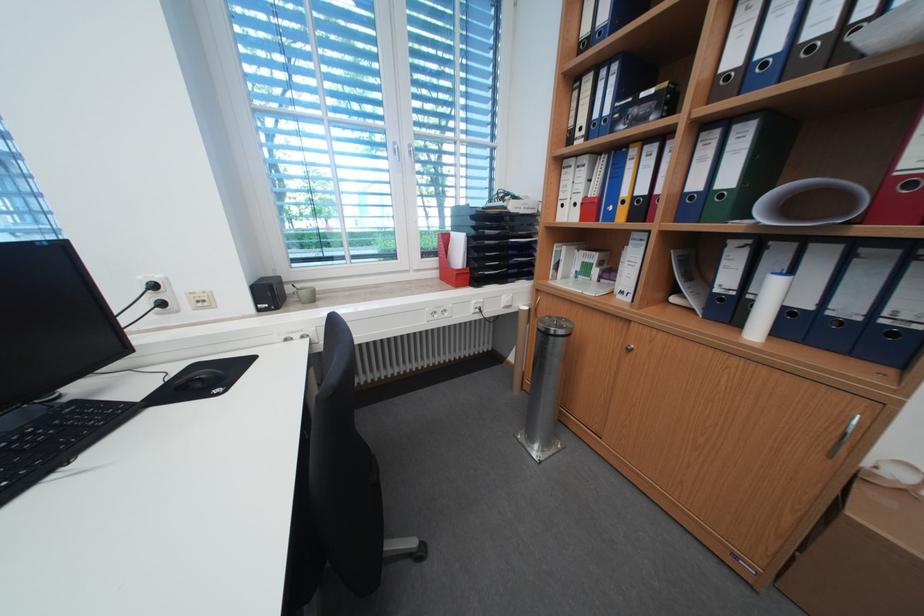
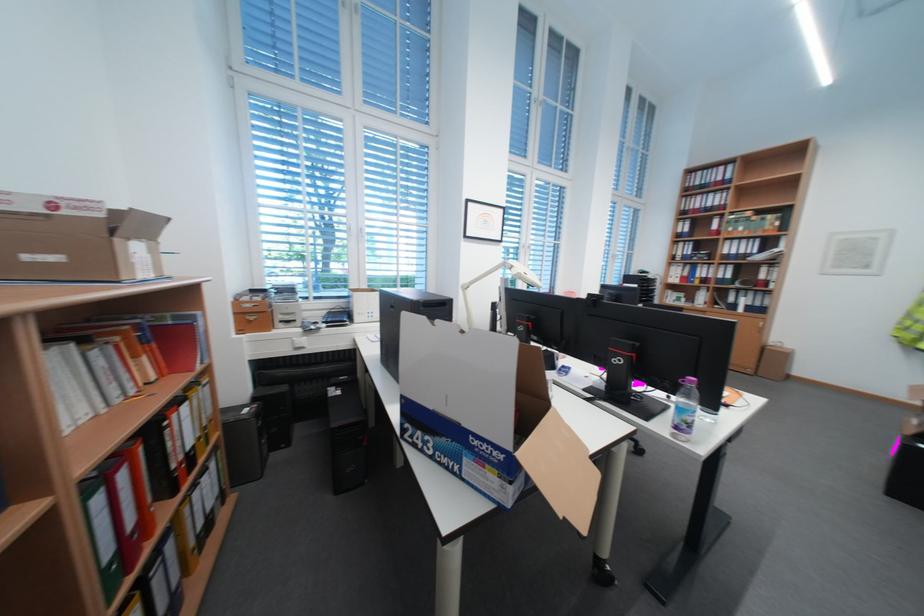
Which direction would the cameraman need to move to produce the second image?

The cameraman moved toward left, backward.